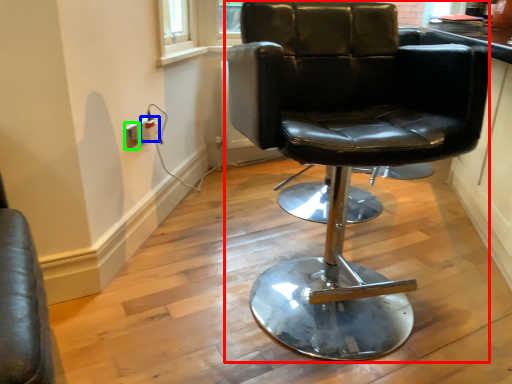
Question: Based on their relative distances, which object is nearer to chair (highlighted by a red box)? Choose from electric outlet (highlighted by a blue box) and electric outlet (highlighted by a green box).

Choices:
 (A) electric outlet
 (B) electric outlet

Answer: (B)